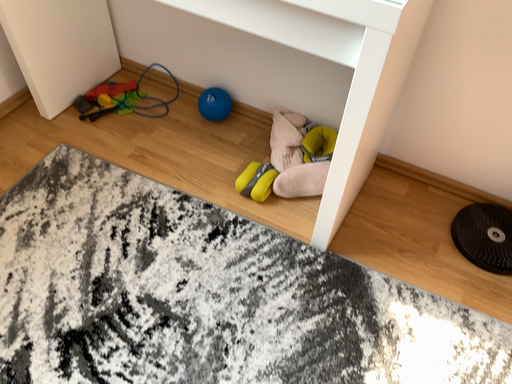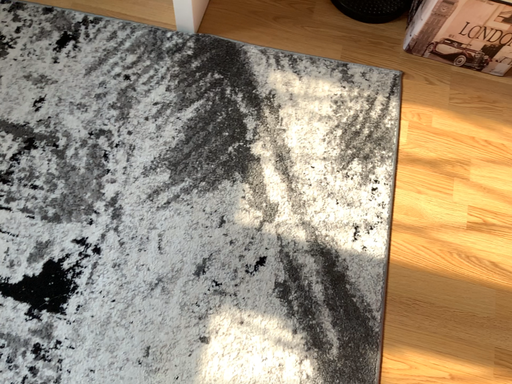
Question: How did the camera likely rotate when shooting the video?

Choices:
 (A) rotated downward
 (B) rotated upward

Answer: (A)